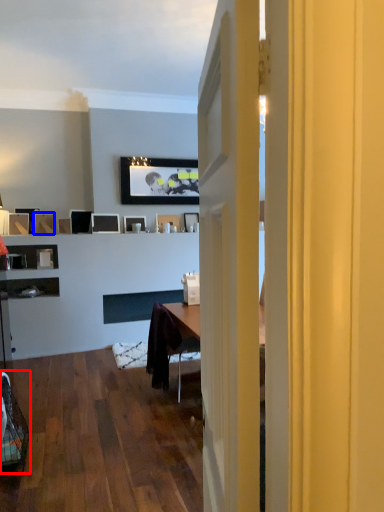
Question: Which object is closer to the camera taking this photo, swivel chair (highlighted by a red box) or picture frame (highlighted by a blue box)?

Choices:
 (A) swivel chair
 (B) picture frame

Answer: (A)